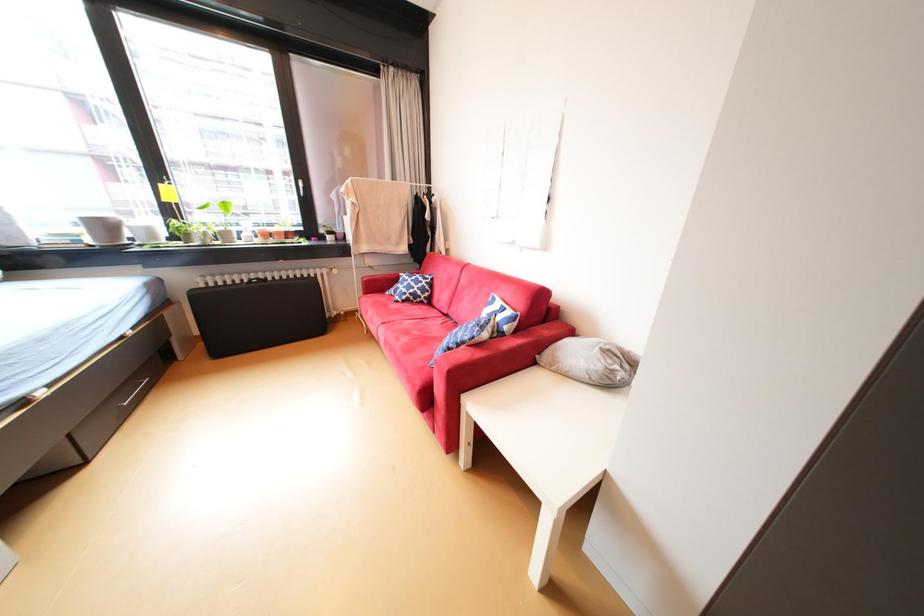
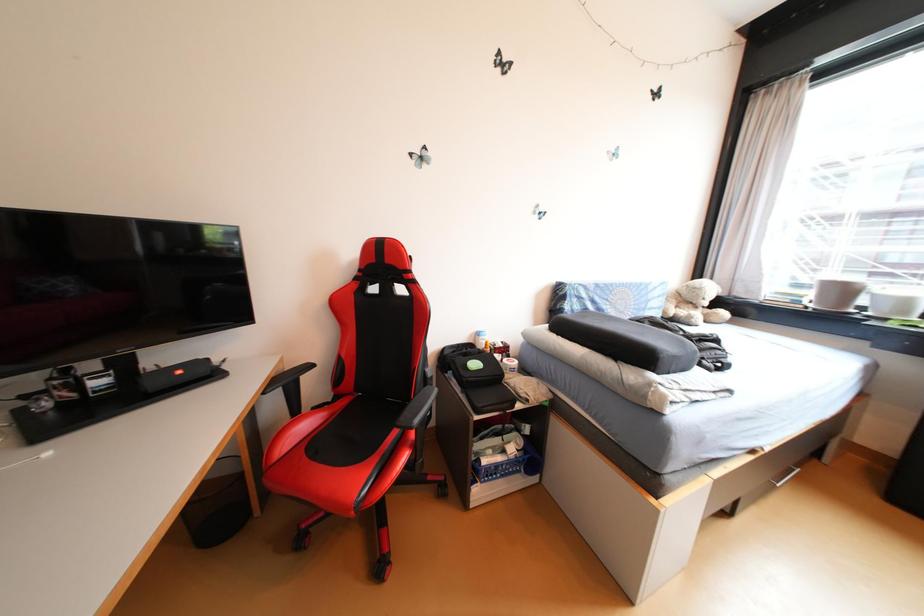
Question: The images are taken continuously from a first-person perspective. In which direction is your viewpoint rotating?

Choices:
 (A) Left
 (B) Right
 (C) Up
 (D) Down

Answer: (A)